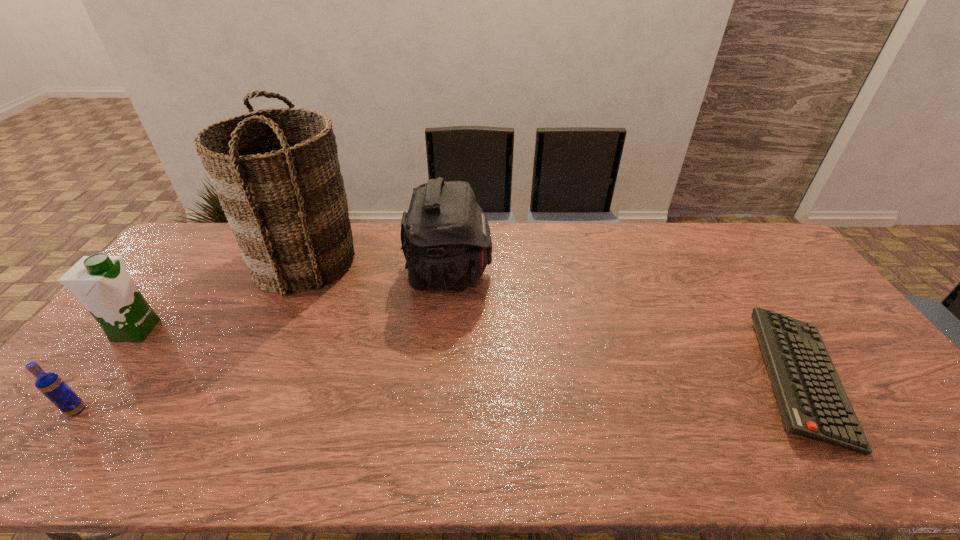
Where is `vacant space that satisfies the following two spatial constraints: 1. on the back side of the vodka; 2. on the front-facing side of the third tallest object`? vacant space that satisfies the following two spatial constraints: 1. on the back side of the vodka; 2. on the front-facing side of the third tallest object is located at coordinates (139, 330).

The width and height of the screenshot is (960, 540). I want to click on vacant position in the image that satisfies the following two spatial constraints: 1. on the open flap of the shortest object; 2. on the left side of the shoulder bag, so click(x=441, y=379).